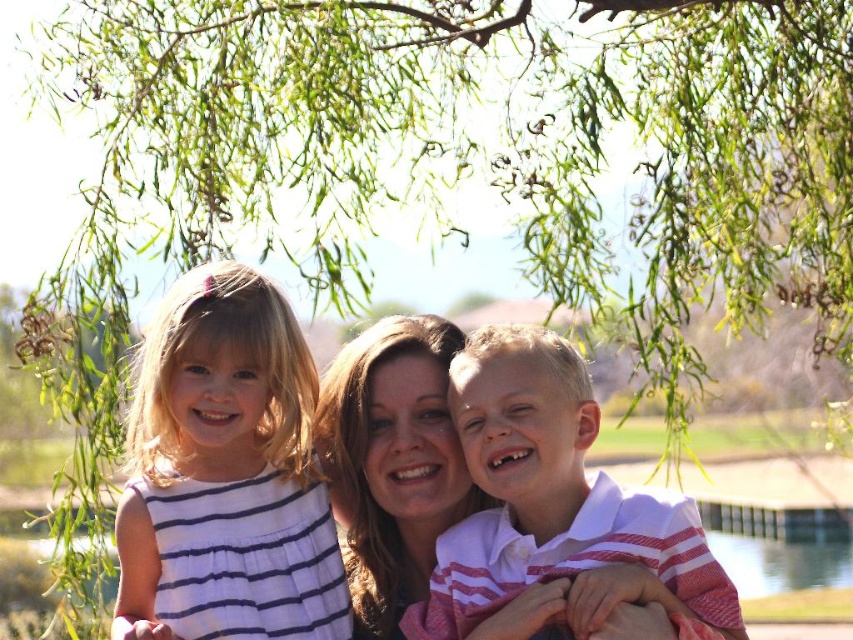
You are a photographer trying to capture a clear photo of both the white striped dress at left and the white striped shirt at center. Which one will appear closer to you in the photo?

The white striped dress at left will appear closer to you in the photo because it is positioned further to the viewer than the white striped shirt at center.

What are the exact coordinates of the white striped dress at left?

The white striped dress at left is located at coordinates point [225,474].

You are a photographer setting up for a family photo under a weeping willow tree. You notice two family members wearing white striped clothing. The first is a young girl in a white striped dress at left, and the second is an adult woman in a white striped shirt at center. Based on their positions and clothing, which family member is taller?

The white striped dress at left is much taller than the white striped shirt at center, so the young girl in the white striped dress at left is taller than the adult woman in the white striped shirt at center.